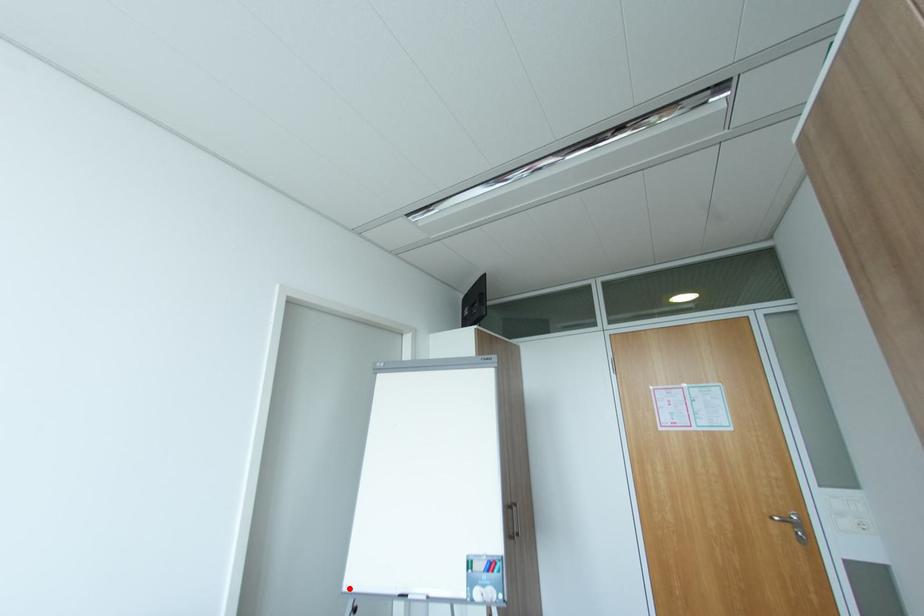
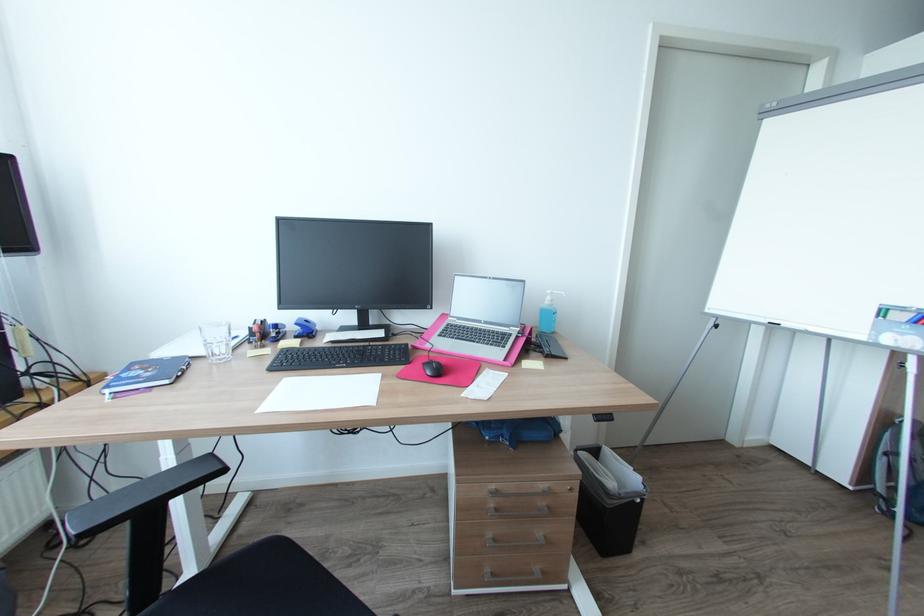
The point at the highlighted location is marked in the first image. Where is the corresponding point in the second image?

(712, 310)